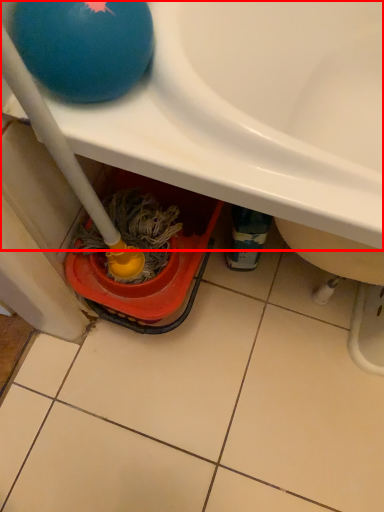
Question: Where is sink (annotated by the red box) located in relation to ball in the image?

Choices:
 (A) right
 (B) left

Answer: (A)